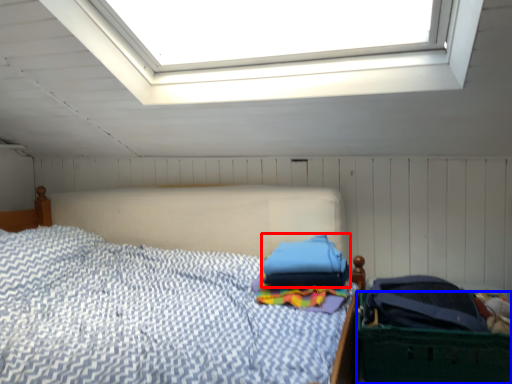
Question: Among these objects, which one is nearest to the camera, pillow (highlighted by a red box) or laundry basket (highlighted by a blue box)?

Choices:
 (A) pillow
 (B) laundry basket

Answer: (B)